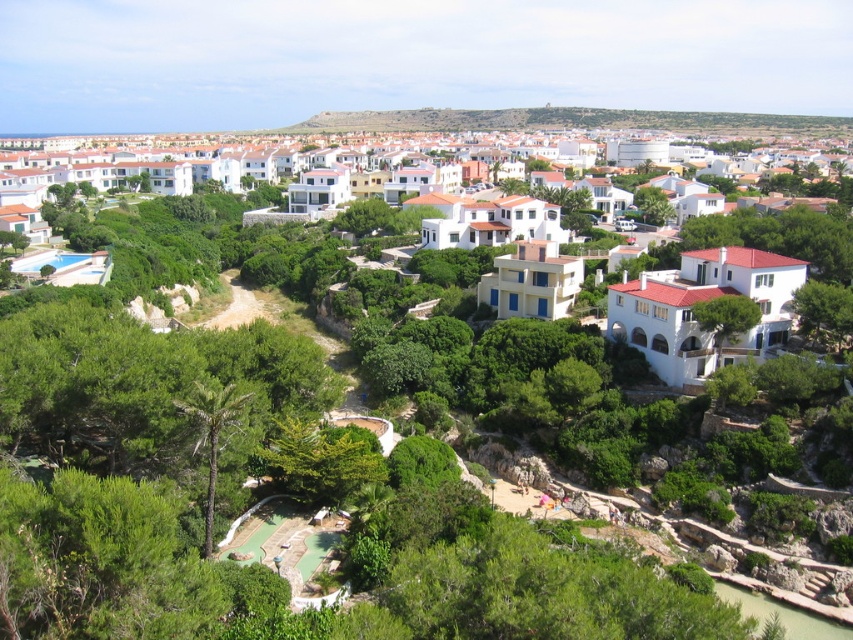
Question: Can you confirm if green leafy palm at lower left is positioned to the left of green leafy tree at right?

Choices:
 (A) yes
 (B) no

Answer: (A)

Question: Which of the following is the farthest from the observer?

Choices:
 (A) (711, 321)
 (B) (213, 406)
 (C) (804, 259)
 (D) (312, 435)

Answer: (C)

Question: Considering the relative positions of green leafy tree at center and green leafy tree at right in the image provided, where is green leafy tree at center located with respect to green leafy tree at right?

Choices:
 (A) below
 (B) above

Answer: (A)

Question: Which of the following is the closest to the observer?

Choices:
 (A) click(798, 257)
 (B) click(204, 524)

Answer: (B)

Question: Which of these objects is positioned farthest from the green leafy palm at lower left?

Choices:
 (A) green leafy tree at center
 (B) green leafy tree at right
 (C) white matte houses at center

Answer: (C)

Question: In this image, where is white matte houses at center located relative to green leafy tree at center-right?

Choices:
 (A) below
 (B) above

Answer: (B)